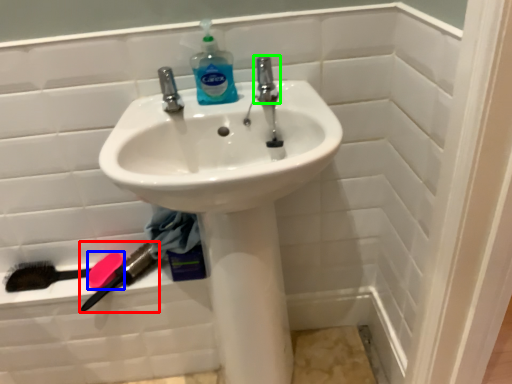
Question: Which object is positioned farthest from brush (highlighted by a red box)? Select from soap (highlighted by a blue box) and tap (highlighted by a green box).

Choices:
 (A) soap
 (B) tap

Answer: (B)